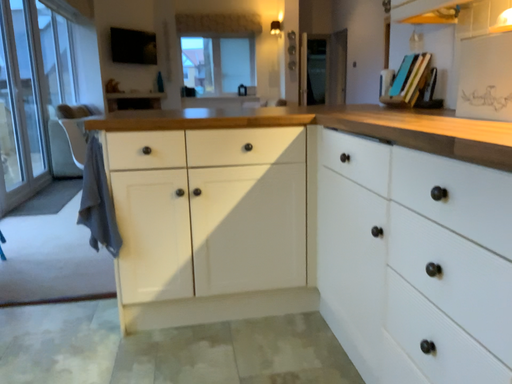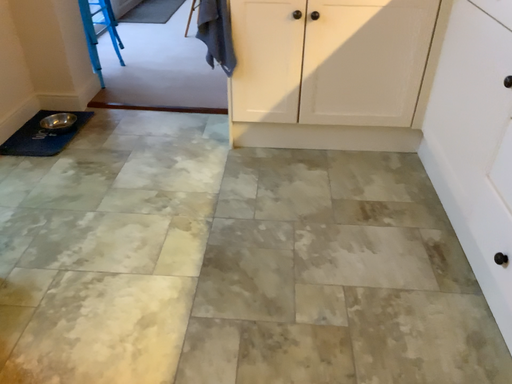
Question: How did the camera likely rotate when shooting the video?

Choices:
 (A) rotated upward
 (B) rotated downward

Answer: (B)